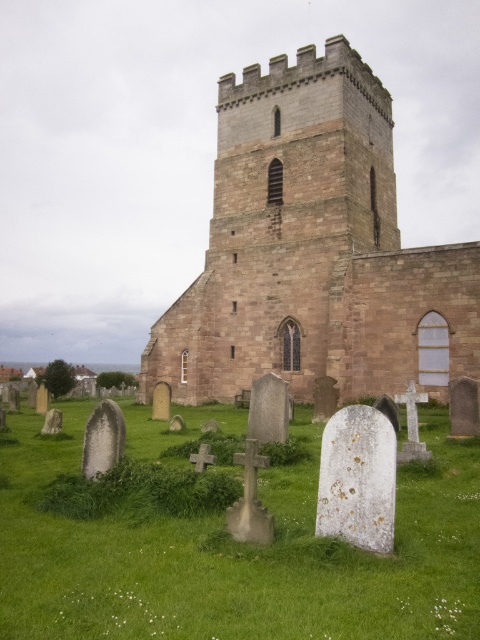
Question: Can you confirm if brown stone church at center is positioned to the right of green grass at lower center?

Choices:
 (A) yes
 (B) no

Answer: (A)

Question: Does brown stone church at center have a lesser width compared to green grass at lower center?

Choices:
 (A) yes
 (B) no

Answer: (A)

Question: Which of the following is the farthest from the observer?

Choices:
 (A) green grass at lower center
 (B) brown stone church at center

Answer: (B)

Question: Does brown stone church at center have a greater width compared to green grass at lower center?

Choices:
 (A) yes
 (B) no

Answer: (B)